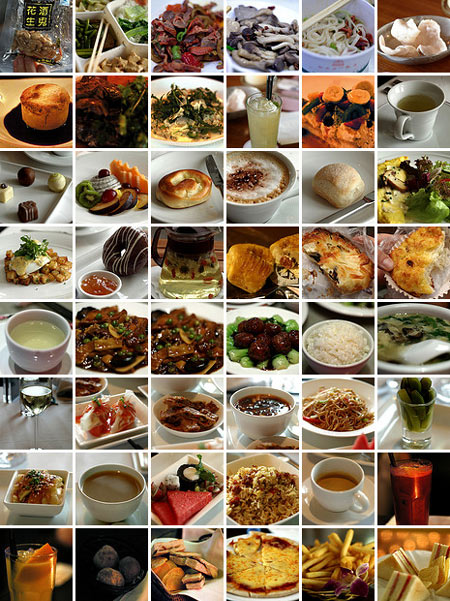
Image resolution: width=450 pixels, height=601 pixels. I want to click on drinking glasses or mugs or cups, so click(x=421, y=123), click(x=265, y=120), click(x=417, y=416), click(x=36, y=400), click(x=331, y=499), click(x=411, y=502), click(x=32, y=580).